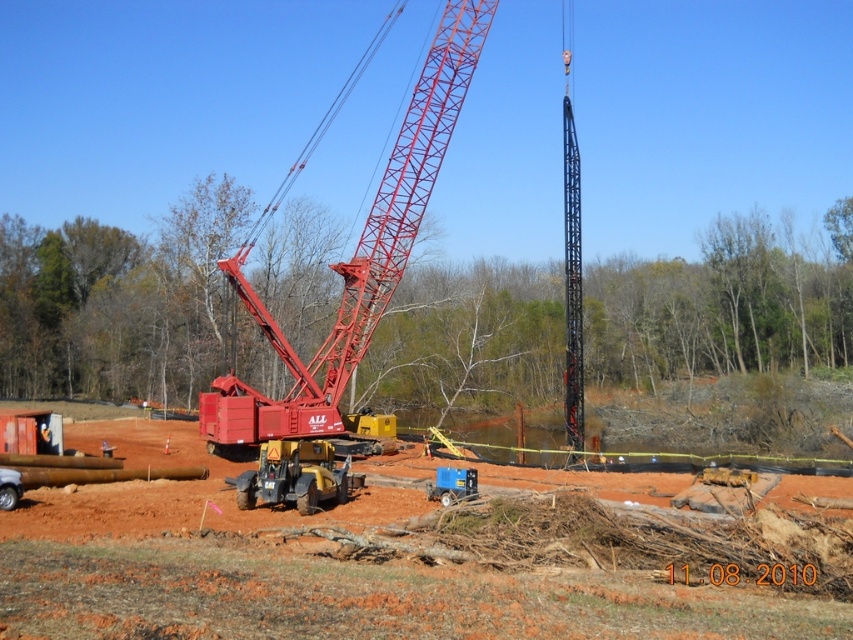
You are a construction worker standing at the edge of the construction site. You need to move from point A to point B. Point A is located at coordinate point A, which is point (415, 621), and point B is at coordinate point B, which is point (488, 24). Which direction should you walk to get from point A to point B?

To move from point A to point B, you should walk towards the left since point A is in front of point B, indicating that point B is located to the left of point A.

You are a construction worker on a sunny day at the construction site. You need to move the yellow rubber tractor at center to another location. Is it possible to move it without moving the metallic red crane at center first?

The metallic red crane at center is positioned over the yellow rubber tractor at center. Therefore, you must move the metallic red crane at center first before moving the yellow rubber tractor at center.